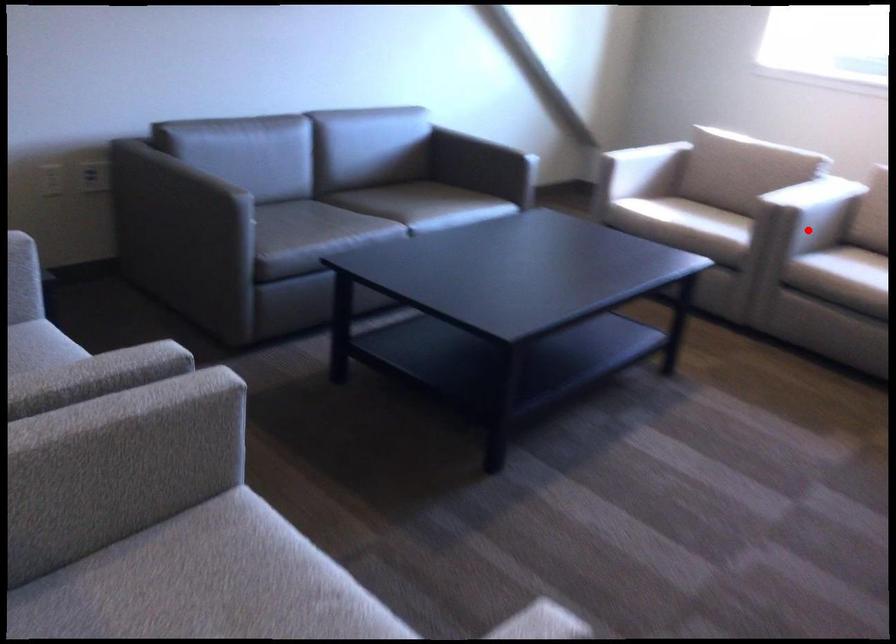
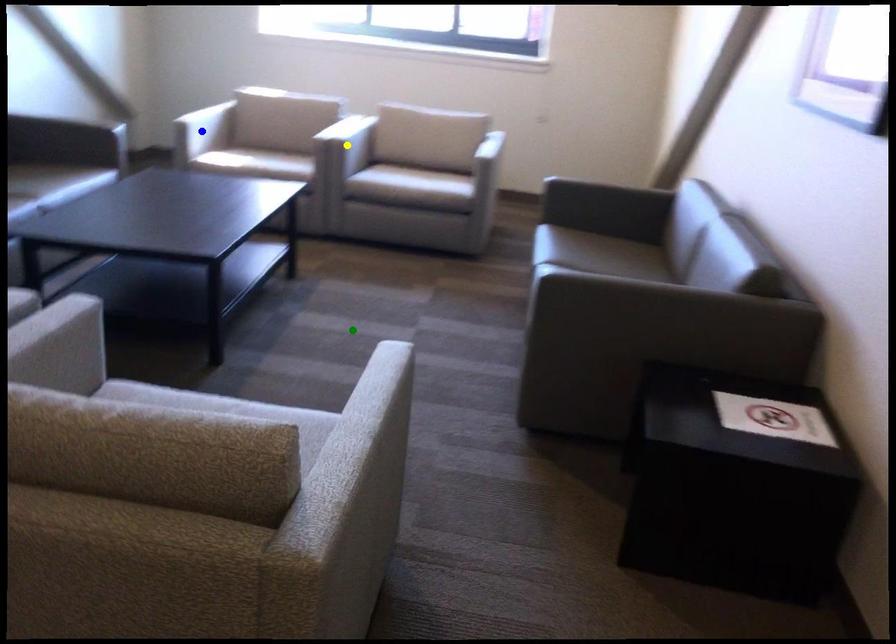
Question: I am providing you with two images of the same scene from different viewpoints. A red point is marked on the first image. You are given multiple points on the second image. In image 2, which mark is for the same physical point as the one in image 1?

Choices:
 (A) green point
 (B) blue point
 (C) yellow point

Answer: (C)